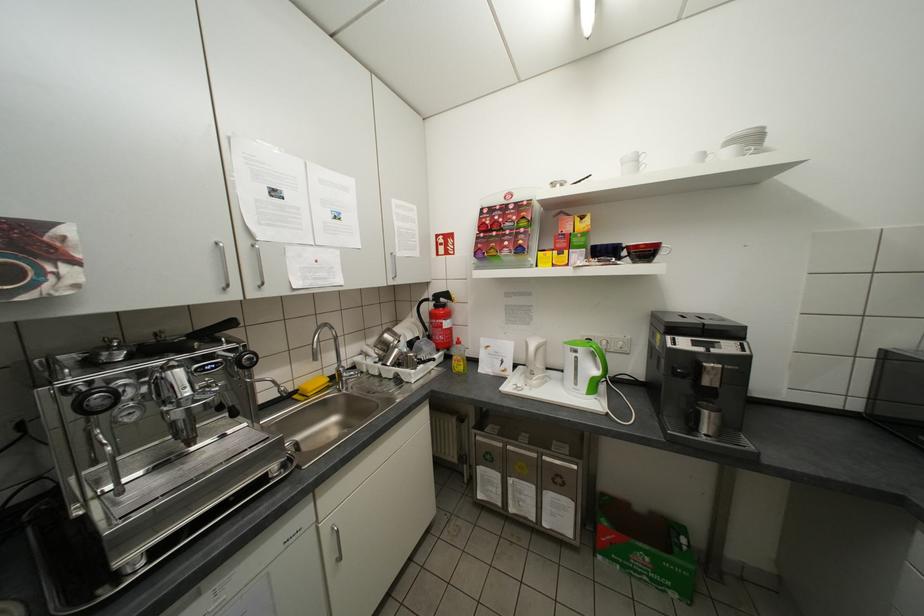
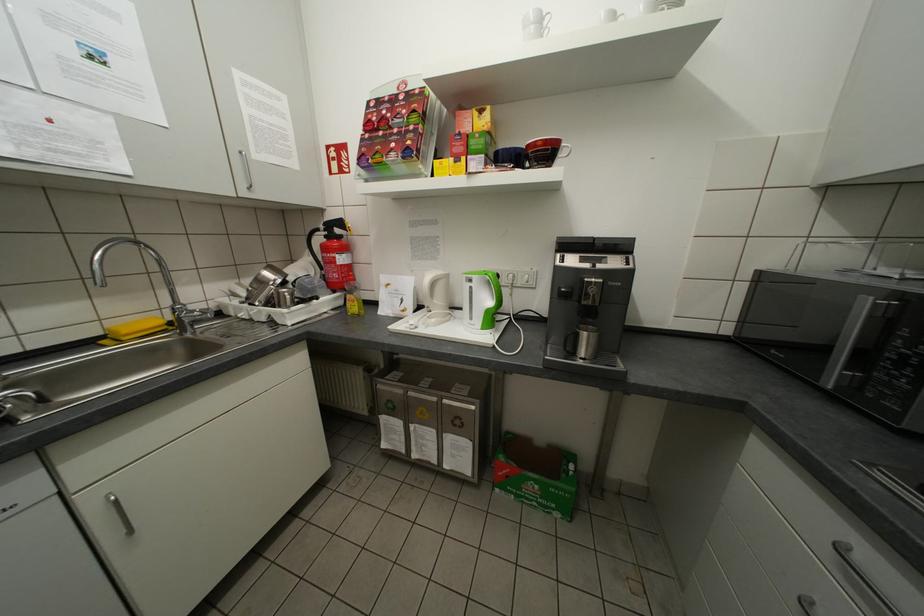
The point at (399,276) is marked in the first image. Where is the corresponding point in the second image?

(251, 185)